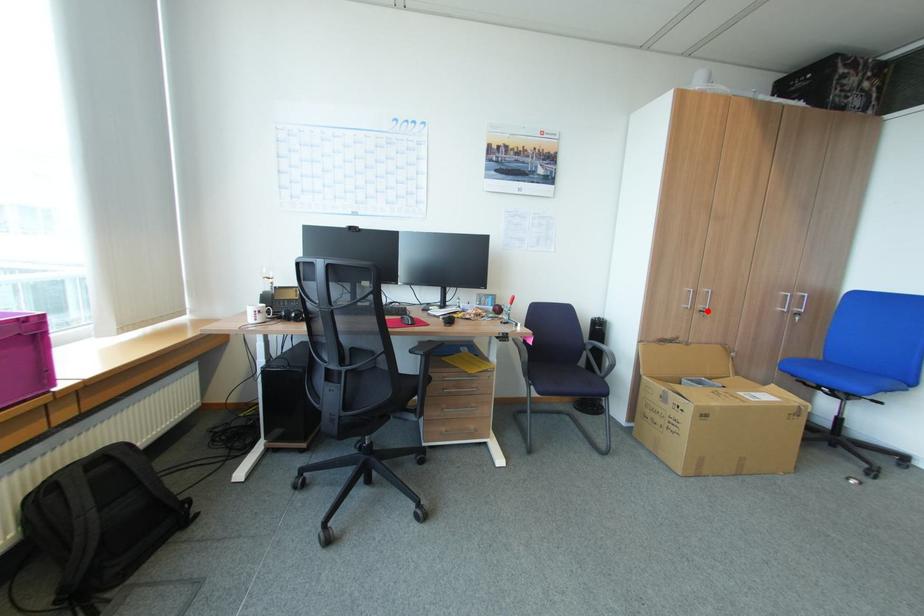
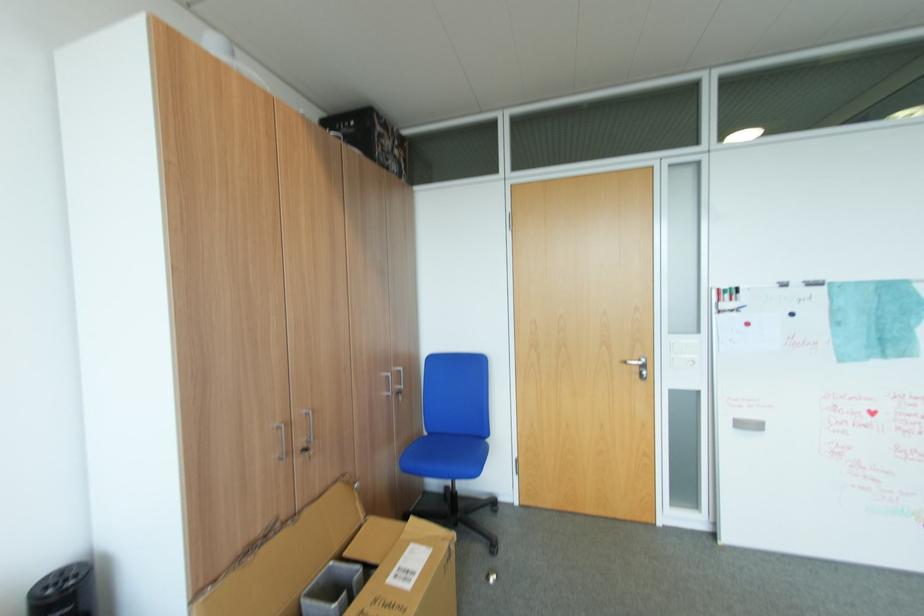
Where in the second image is the point corresponding to the highlighted location from the first image?

(310, 451)